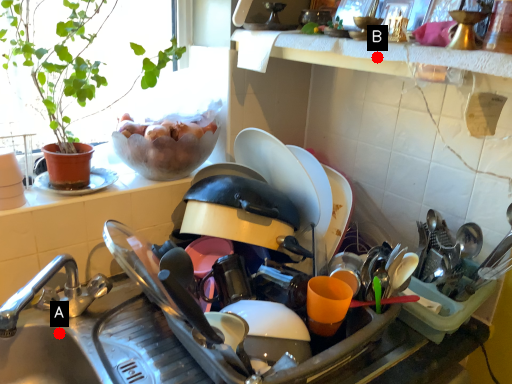
Question: Two points are circled on the image, labeled by A and B beside each circle. Which of the following is the closest to the observer?

Choices:
 (A) A is closer
 (B) B is closer

Answer: (B)